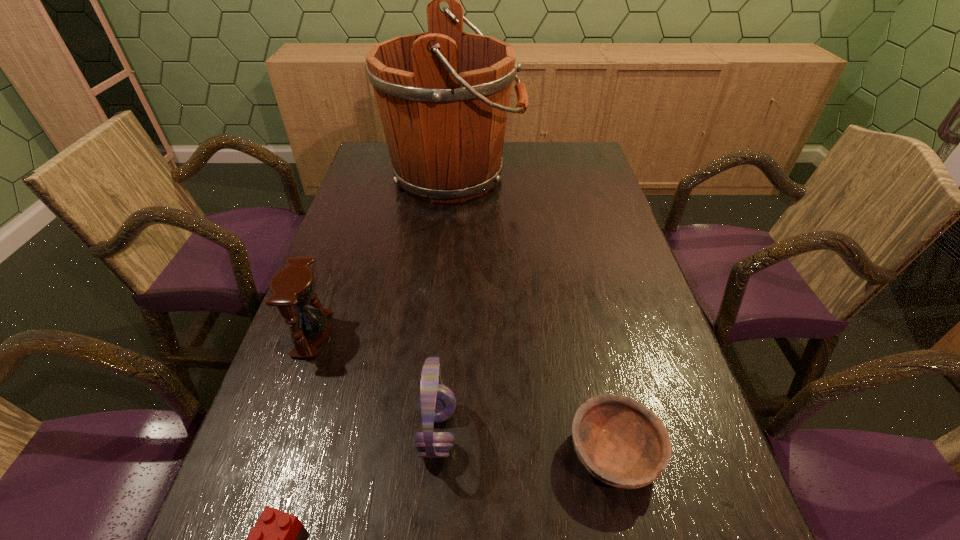
Where is `the farthest object`? the farthest object is located at coordinates (443, 96).

Identify the location of bucket. The width and height of the screenshot is (960, 540). (443, 96).

Identify the location of headset. The image size is (960, 540). pyautogui.click(x=436, y=403).

In order to click on hourglass in this screenshot , I will do `click(293, 286)`.

Where is `the second shortest object`? This screenshot has width=960, height=540. the second shortest object is located at coordinates (622, 443).

This screenshot has width=960, height=540. In order to click on bowl in this screenshot , I will do `click(622, 443)`.

This screenshot has width=960, height=540. Identify the location of vacant space located with the handle on the side of the bucket. (541, 176).

The width and height of the screenshot is (960, 540). In order to click on vacant space located 0.130m on the headband and ear cups of the headset in this screenshot , I will do `click(527, 431)`.

At what (x,y) coordinates should I click in order to perform the action: click on vacant point located on the front of the hourglass. Please return your answer as a coordinate pair (x, y). Looking at the image, I should click on (252, 501).

The height and width of the screenshot is (540, 960). I want to click on vacant space positioned 0.400m on the left of the second shortest object, so [x=339, y=454].